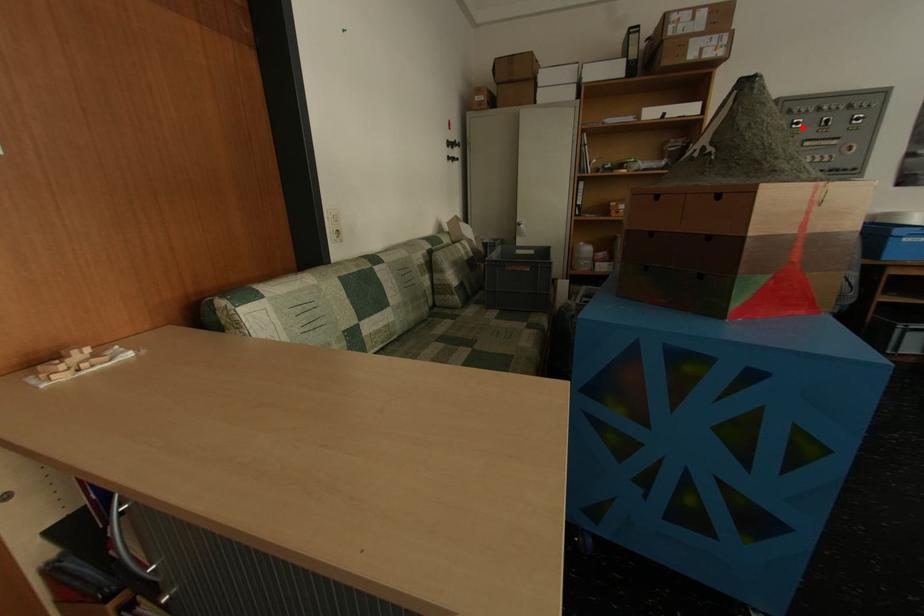
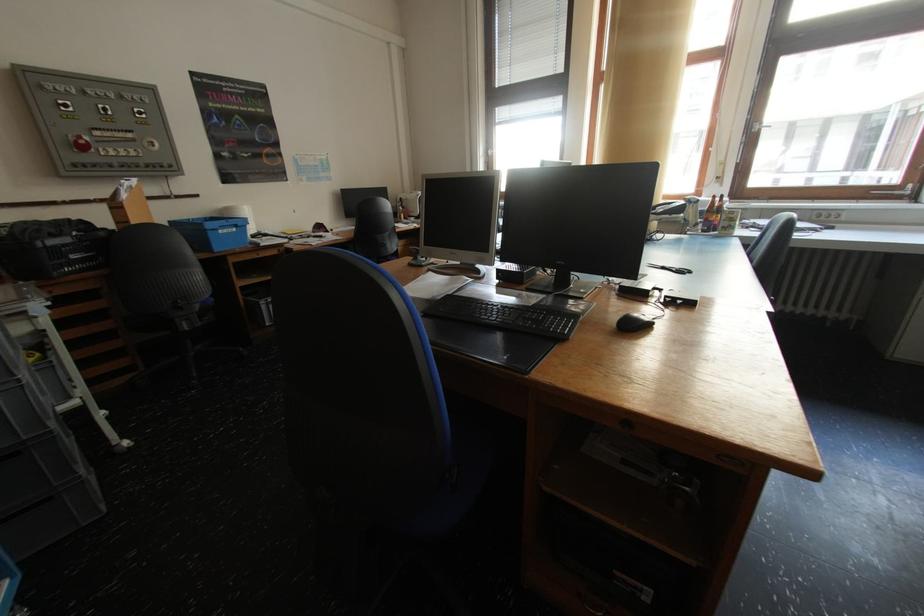
Locate, in the second image, the point that corresponds to the highlighted location in the first image.

(71, 110)